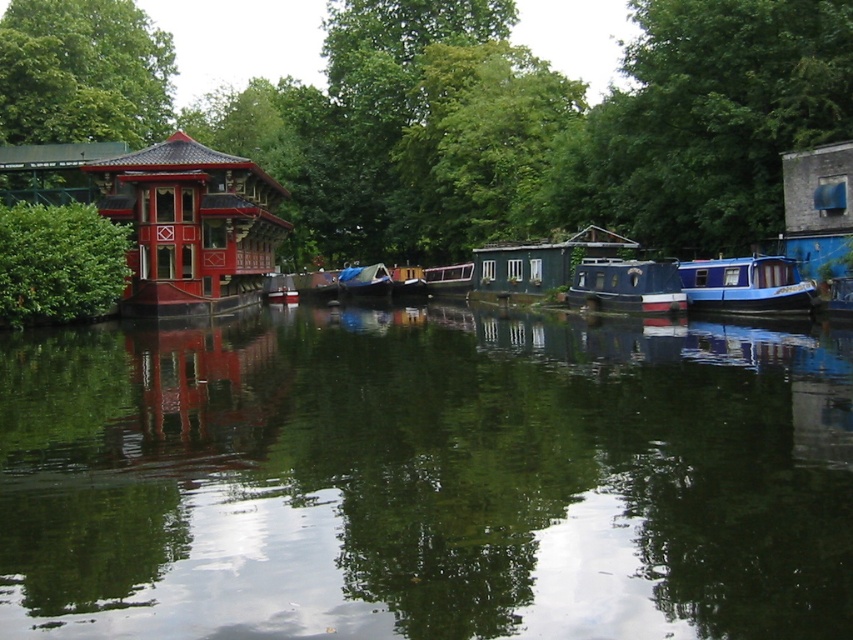
Does shiny lacquered gazebo at left lie behind blue polished wood boat at center?

Yes, it is.

Who is positioned more to the right, shiny lacquered gazebo at left or blue polished wood boat at center?

blue polished wood boat at center

Identify the location of shiny lacquered gazebo at left. (190, 225).

I want to click on shiny lacquered gazebo at left, so click(x=190, y=225).

Who is positioned more to the left, shiny lacquered gazebo at left or matte red boat at center?

From the viewer's perspective, shiny lacquered gazebo at left appears more on the left side.

Does shiny lacquered gazebo at left lie in front of matte red boat at center?

Yes, it is in front of matte red boat at center.

Which is behind, point (193, 243) or point (296, 301)?

Positioned behind is point (296, 301).

Locate an element on the screen. shiny lacquered gazebo at left is located at coordinates (190, 225).

Is green leafy tree at upper right thinner than blue glossy houseboat at center?

In fact, green leafy tree at upper right might be wider than blue glossy houseboat at center.

Who is positioned more to the left, green leafy tree at upper right or blue glossy houseboat at center?

From the viewer's perspective, blue glossy houseboat at center appears more on the left side.

Is point (657, 240) less distant than point (378, 268)?

Yes, point (657, 240) is closer to viewer.

Where is `green leafy tree at upper right`? This screenshot has width=853, height=640. green leafy tree at upper right is located at coordinates (718, 115).